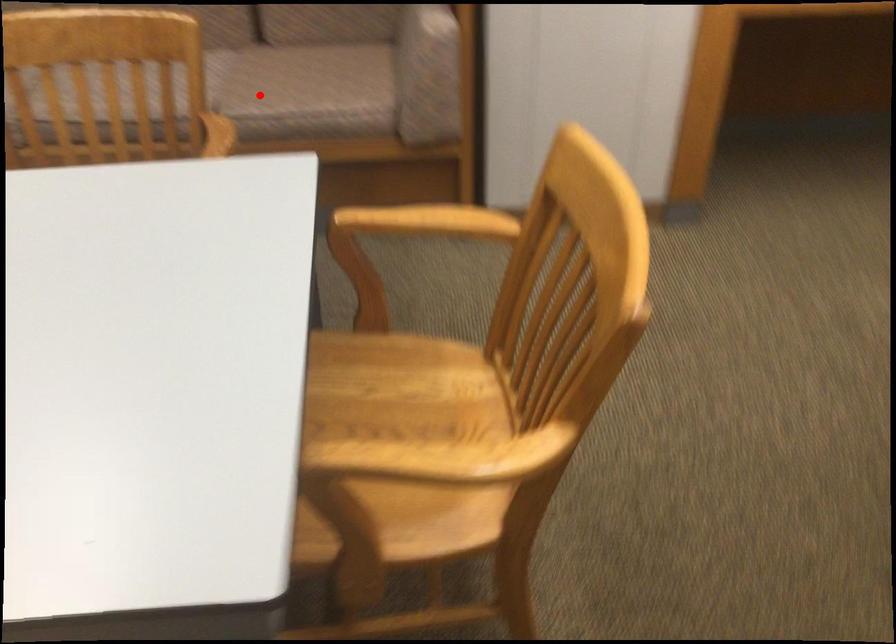
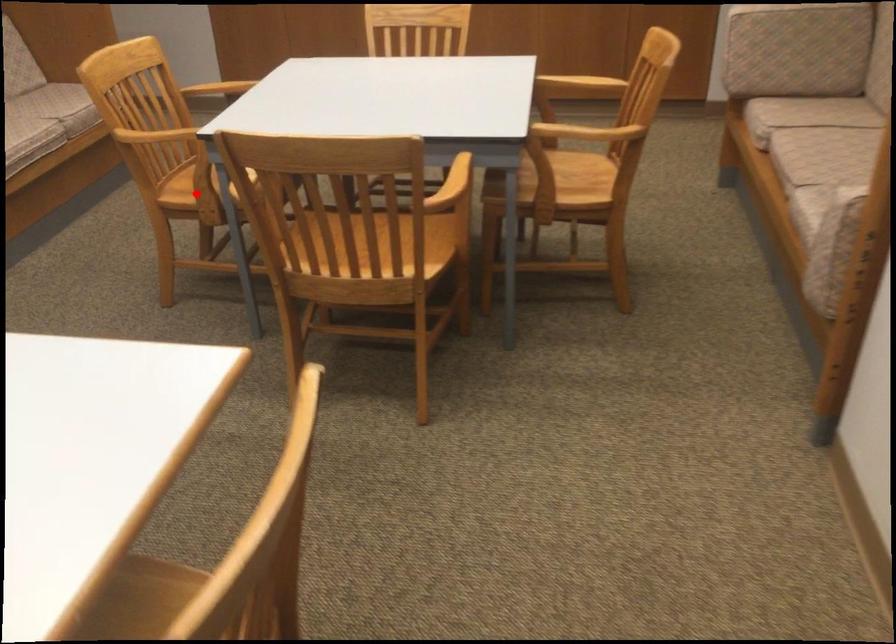
I am providing you with two images of the same scene from different viewpoints. A red point is marked on the first image and another point is marked on the second image. Do the highlighted points in image1 and image2 indicate the same real-world spot?

No